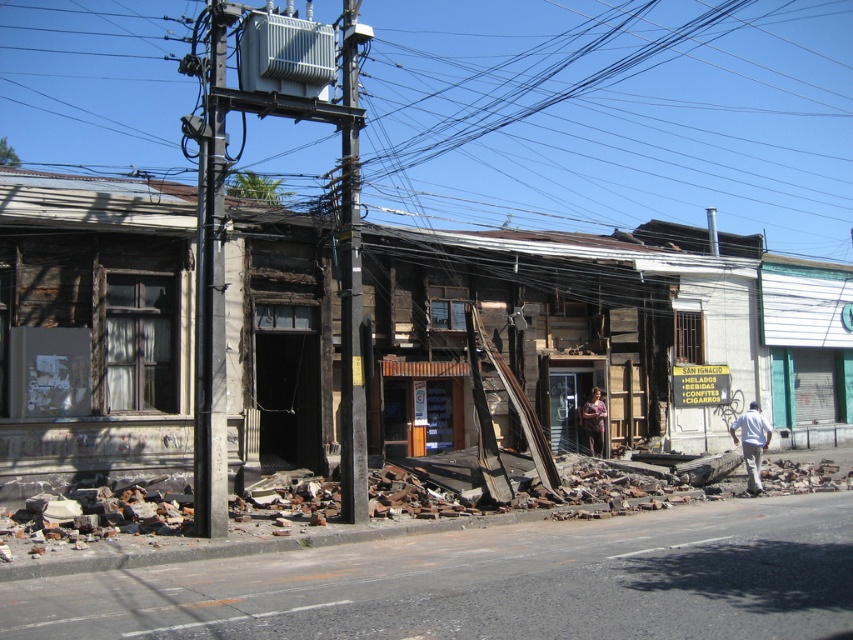
You are standing at the point marked by point (210,284) in the image. Which object is directly in front of you?

The metallic gray utility pole at left is directly in front of you at point (210,284).

You are standing on the street looking at the damaged buildings. There are two points marked in the scene. Which point, point 1 at coordinates (210, 120) or point 2 at coordinates (347, 20), is closer to you?

Point 1 at coordinates (210, 120) is closer to the viewer than point 2 at coordinates (347, 20).